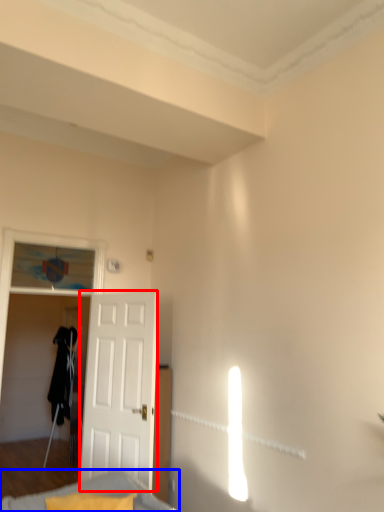
Question: Which of the following is the closest to the observer, door (highlighted by a red box) or furniture (highlighted by a blue box)?

Choices:
 (A) door
 (B) furniture

Answer: (B)